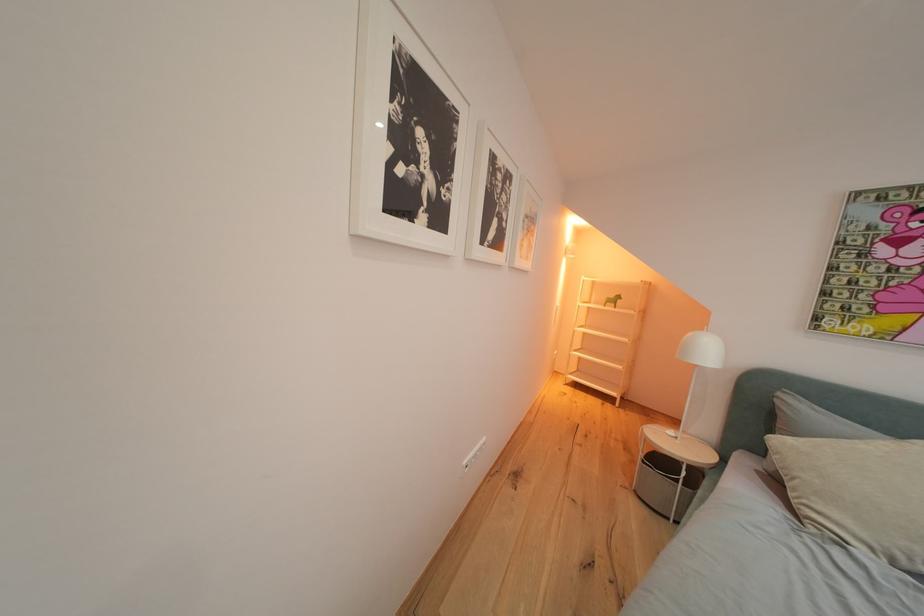
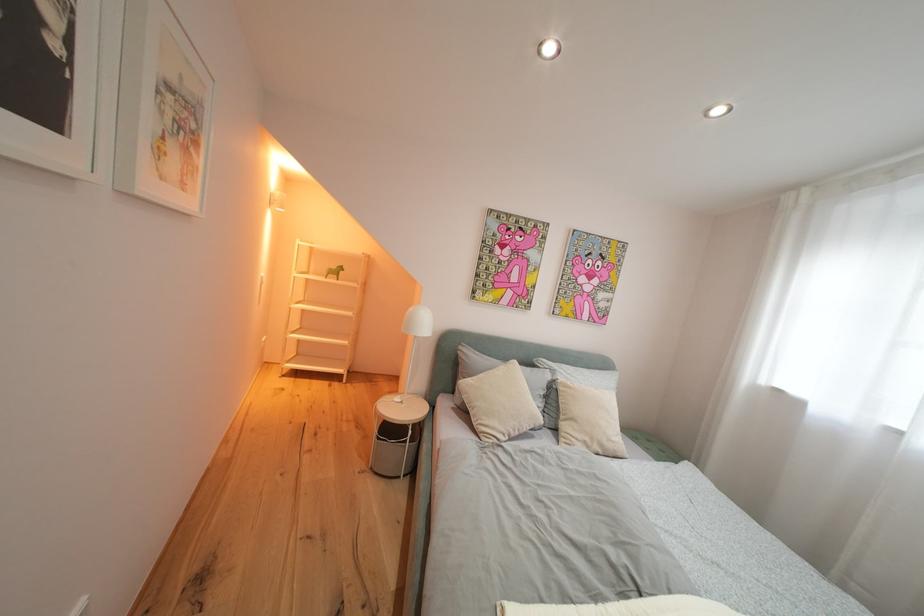
Question: The camera is either moving clockwise (left) or counter-clockwise (right) around the object. The first image is from the beginning of the video and the second image is from the end. Is the camera moving left or right when shooting the video?

Choices:
 (A) Left
 (B) Right

Answer: (A)